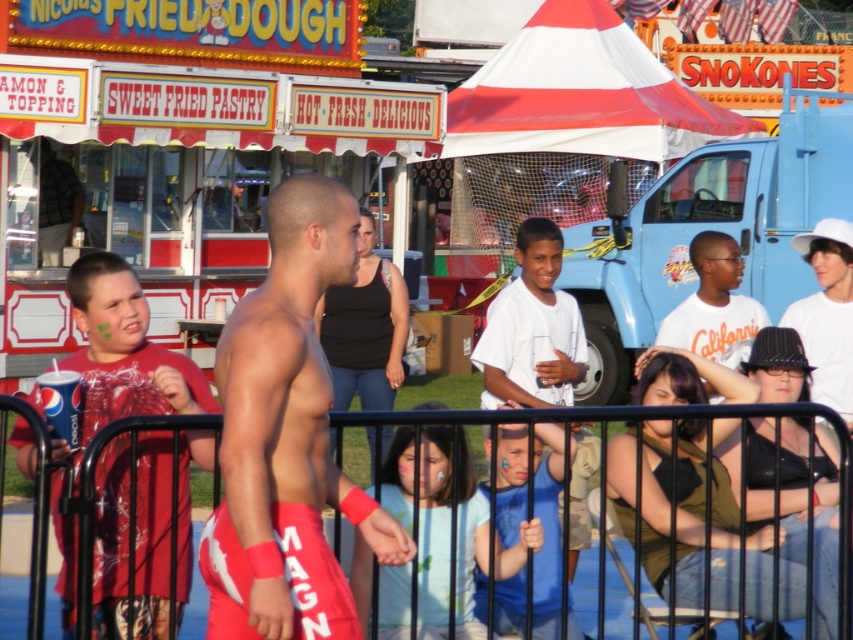
Question: Based on their relative distances, which object is nearer to the red fabric shorts at center?

Choices:
 (A) white cotton t-shirt at upper right
 (B) light blue shirt at center

Answer: (B)

Question: Which object appears farthest from the camera in this image?

Choices:
 (A) white cardboard food truck at upper left
 (B) white matte shirt at center

Answer: (A)

Question: Is white cardboard food truck at upper left closer to the viewer compared to white matte shirt at center?

Choices:
 (A) yes
 (B) no

Answer: (B)

Question: Can you confirm if red fabric shorts at center is wider than white cotton t-shirt at upper right?

Choices:
 (A) yes
 (B) no

Answer: (B)

Question: Does white cardboard food truck at upper left lie in front of blue fabric shirt at center?

Choices:
 (A) no
 (B) yes

Answer: (A)

Question: Which object is the farthest from the blue fabric shirt at center?

Choices:
 (A) white matte hat at upper right
 (B) white matte shirt at center
 (C) white cardboard food truck at upper left

Answer: (C)